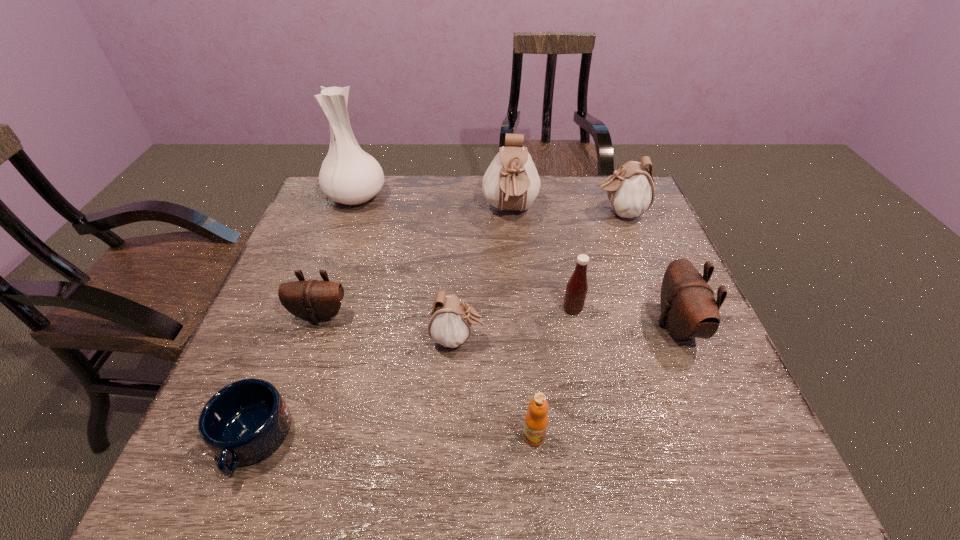
Locate an element on the screen. This screenshot has height=540, width=960. empty space that is in between the tallest object and the Tabasco sauce is located at coordinates (465, 253).

Locate an element on the screen. The image size is (960, 540). unoccupied position between the Tabasco sauce and the rightmost white pouch is located at coordinates (596, 261).

Locate an element on the screen. The height and width of the screenshot is (540, 960). empty location between the bigger brown pouch and the Tabasco sauce is located at coordinates (625, 317).

I want to click on free area in between the blue mug and the orange juice, so click(393, 437).

This screenshot has width=960, height=540. What are the coordinates of `empty space between the second smallest white pouch and the right brown pouch` in the screenshot? It's located at (648, 269).

Find the location of a particular element. This screenshot has width=960, height=540. free space between the left brown pouch and the orange juice is located at coordinates (427, 375).

Locate which object ranks sixth in proximity to the smaller brown pouch. Please provide its 2D coordinates. Your answer should be formatted as a tuple, i.e. [(x, y)], where the tuple contains the x and y coordinates of a point satisfying the conditions above.

[(576, 290)]

Select which object is the sixth closest to the white vase. Please provide its 2D coordinates. Your answer should be formatted as a tuple, i.e. [(x, y)], where the tuple contains the x and y coordinates of a point satisfying the conditions above.

[(630, 190)]

This screenshot has width=960, height=540. Find the location of `pouch that is the third closest one to the white vase`. pouch that is the third closest one to the white vase is located at coordinates (450, 320).

Locate which pouch ranks fourth in proximity to the white Tabasco sauce. Please provide its 2D coordinates. Your answer should be formatted as a tuple, i.e. [(x, y)], where the tuple contains the x and y coordinates of a point satisfying the conditions above.

[(630, 190)]